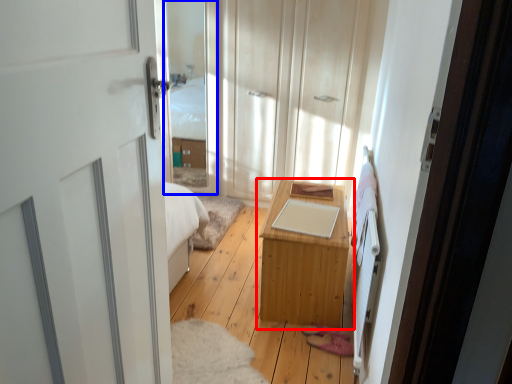
Question: Among these objects, which one is nearest to the camera, table (highlighted by a red box) or glass door (highlighted by a blue box)?

Choices:
 (A) table
 (B) glass door

Answer: (A)